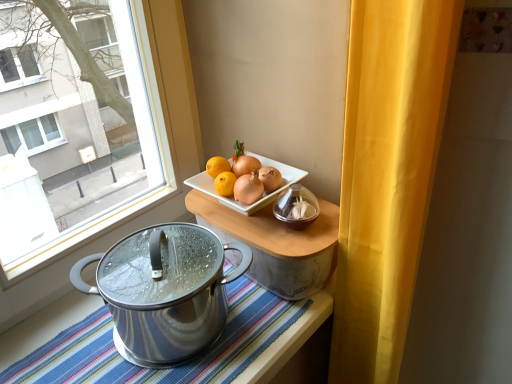
Where is `vacant space underneath polished stainless steel pot at lower left (from a real-world perspective)`? The height and width of the screenshot is (384, 512). vacant space underneath polished stainless steel pot at lower left (from a real-world perspective) is located at coordinates (175, 333).